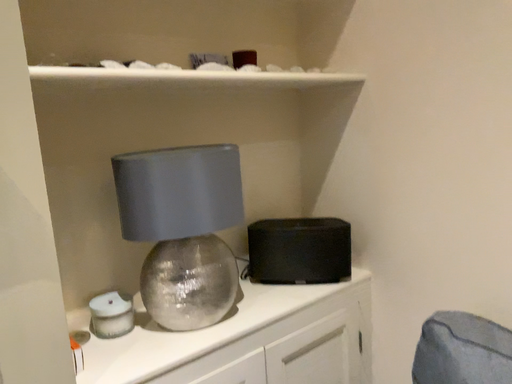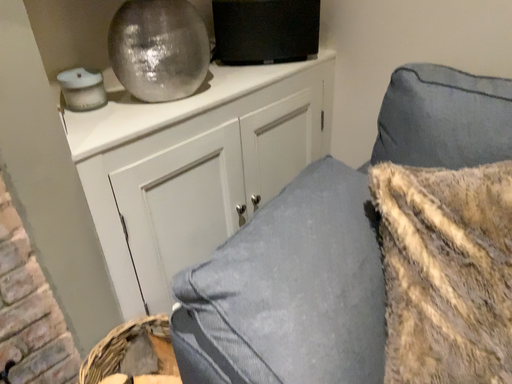
Question: How did the camera likely rotate when shooting the video?

Choices:
 (A) rotated right
 (B) rotated left

Answer: (A)